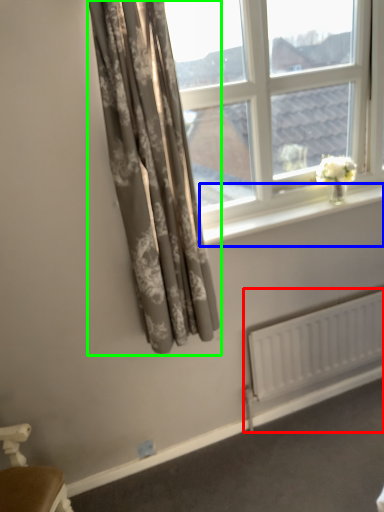
Question: Which is nearer to the radiator (highlighted by a red box)? window sill (highlighted by a blue box) or curtain (highlighted by a green box).

Choices:
 (A) window sill
 (B) curtain

Answer: (A)